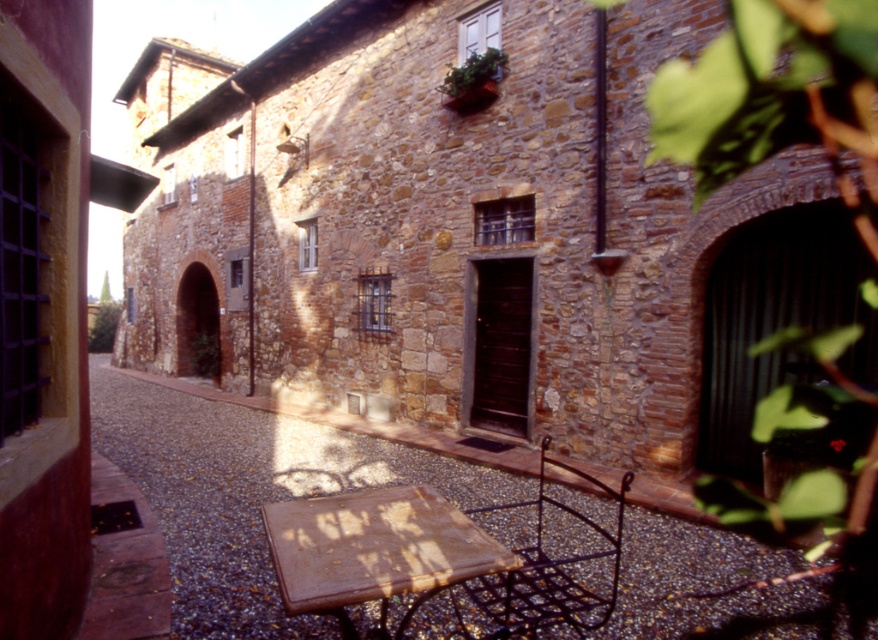
Who is more forward, (364, 497) or (573, 625)?

Point (573, 625)

Where is `rusty metal table at lower center`? The height and width of the screenshot is (640, 878). rusty metal table at lower center is located at coordinates (373, 552).